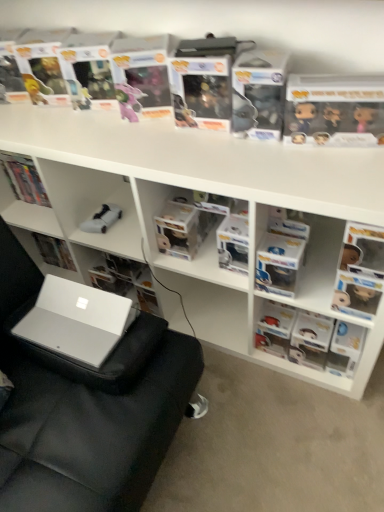
Where is `free space to the left of matte black figurine at upper right, the first paperback book from the right`? Image resolution: width=384 pixels, height=512 pixels. free space to the left of matte black figurine at upper right, the first paperback book from the right is located at coordinates click(x=276, y=159).